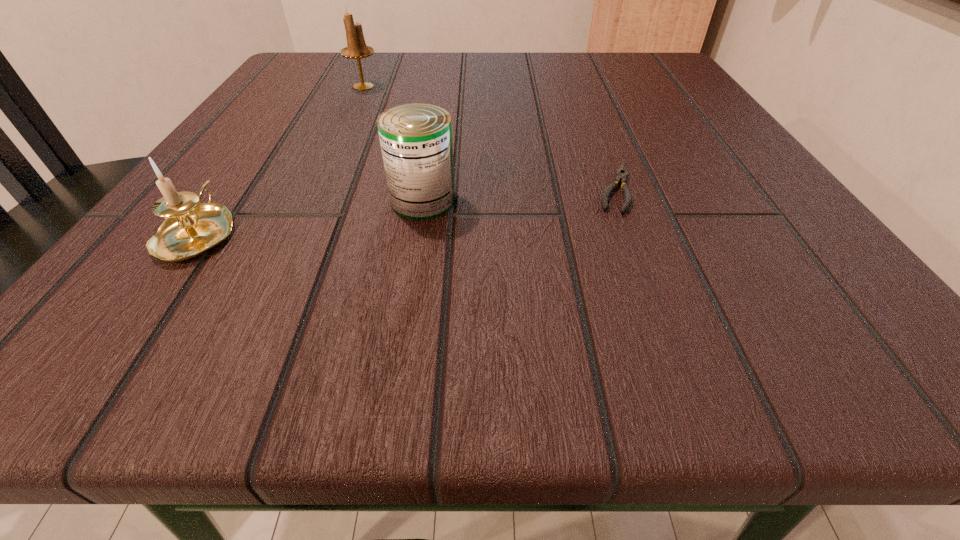
This screenshot has height=540, width=960. Identify the location of vacant region at the near left corner of the desktop. (121, 352).

Locate an element on the screen. This screenshot has height=540, width=960. vacant region at the far right corner is located at coordinates (608, 76).

The image size is (960, 540). Find the location of `free space between the second object from right to left and the shortest object`. free space between the second object from right to left and the shortest object is located at coordinates (519, 194).

Where is `empty space between the second object from right to left and the nearer candle holder`? empty space between the second object from right to left and the nearer candle holder is located at coordinates (310, 217).

Where is `unoccupied position between the can and the left candle holder`? The width and height of the screenshot is (960, 540). unoccupied position between the can and the left candle holder is located at coordinates (310, 217).

Where is `free space between the nearer candle holder and the farther candle holder`? This screenshot has width=960, height=540. free space between the nearer candle holder and the farther candle holder is located at coordinates (280, 159).

This screenshot has width=960, height=540. Find the location of `blank region between the can and the rightmost object`. blank region between the can and the rightmost object is located at coordinates (519, 194).

I want to click on free space between the farther candle holder and the shortest object, so click(490, 137).

Image resolution: width=960 pixels, height=540 pixels. I want to click on free space between the nearer candle holder and the can, so click(310, 217).

Identify the location of vacant region between the rightmost object and the can. The image size is (960, 540). (519, 194).